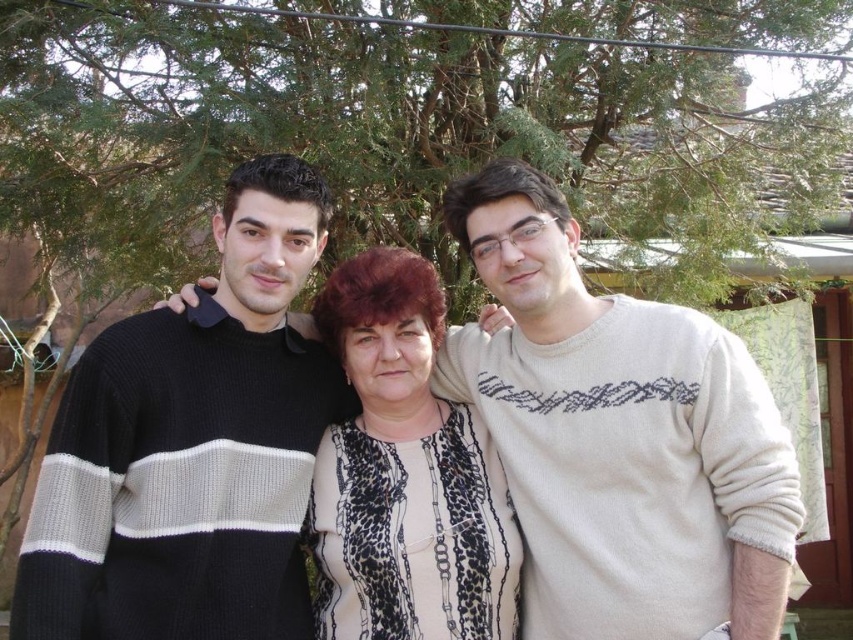
You are standing in a garden with three people and want to place a small garden ornament. You need to decide between placing it at point (154, 566) or point (343, 624). Which point is closer to the building with the sloped roof?

Point (343, 624) is closer to the building with the sloped roof because it is behind point (154, 566).

You are trying to decide which of the two items, the black knit sweater at center or the leopard print blouse at center, would be more suitable to wear in a windy day. Based on their appearance, which one do you think is wider and thus better at blocking the wind?

The black knit sweater at center might be wider than leopard print blouse at center, so it could be more effective at blocking wind due to its wider design.